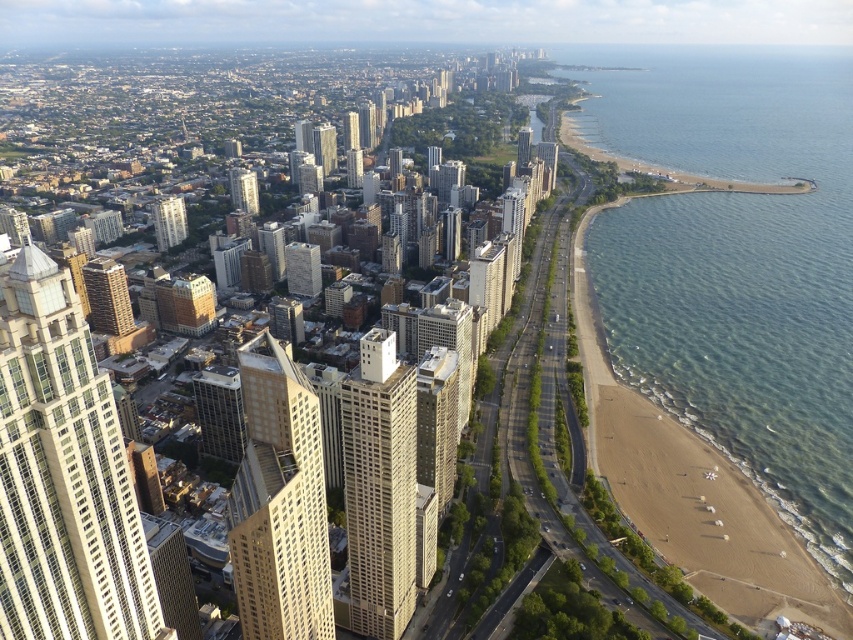
Which of these two, beige glass skyscraper at center-left or matte glass skyscraper at center-left, stands shorter?

Standing shorter between the two is matte glass skyscraper at center-left.

Is beige glass skyscraper at center-left taller than matte glass skyscraper at center-left?

Indeed, beige glass skyscraper at center-left has a greater height compared to matte glass skyscraper at center-left.

Is point (273, 632) behind point (253, 202)?

No, (273, 632) is in front of (253, 202).

At what (x,y) coordinates should I click in order to perform the action: click on beige glass skyscraper at center-left. Please return your answer as a coordinate pair (x, y). Looking at the image, I should click on (279, 502).

Does gold textured building at center-left have a greater width compared to matte glass skyscraper at center-left?

Yes.

Is point (112, 298) behind point (236, 172)?

No, it is not.

Locate an element on the screen. This screenshot has height=640, width=853. gold textured building at center-left is located at coordinates (107, 296).

Is point (653, 244) positioned in front of point (229, 170)?

Yes, it is in front of point (229, 170).

Does clear blue water at beach right appear over matte glass skyscraper at center-left?

No.

This screenshot has width=853, height=640. Describe the element at coordinates (735, 262) in the screenshot. I see `clear blue water at beach right` at that location.

Where is `clear blue water at beach right`? clear blue water at beach right is located at coordinates click(735, 262).